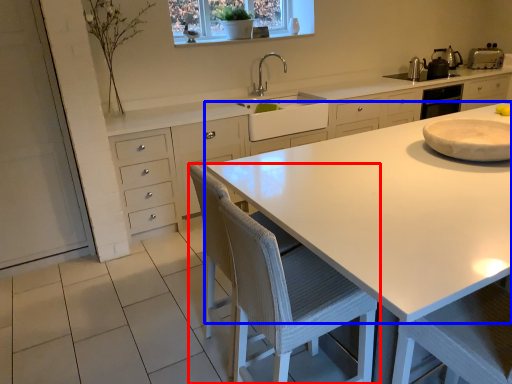
Question: Which of the following is the closest to the observer, chair (highlighted by a red box) or countertop (highlighted by a blue box)?

Choices:
 (A) chair
 (B) countertop

Answer: (B)